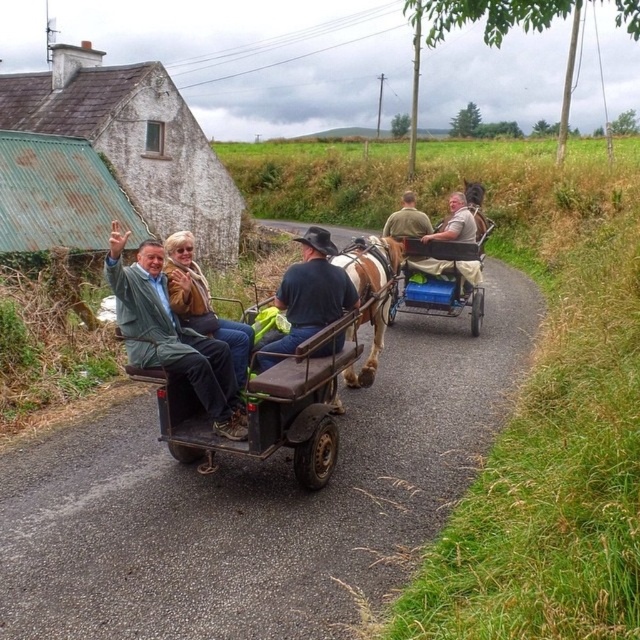
Question: Can you confirm if wooden wagon at center is wider than matte brown jacket at center?

Choices:
 (A) no
 (B) yes

Answer: (B)

Question: Which of the following is the farthest from the observer?

Choices:
 (A) (394, 260)
 (B) (420, 268)
 (C) (268, 424)
 (D) (346, 275)

Answer: (B)

Question: Estimate the real-world distances between objects in this image. Which object is closer to the green fabric jacket at center?

Choices:
 (A) dark blue denim jeans at center
 (B) brown glossy horse at center

Answer: (A)

Question: Which object is the closest to the matte brown jacket at center?

Choices:
 (A) wooden cart at center
 (B) light brown leather jacket at center

Answer: (A)

Question: Does wooden cart at center appear on the right side of matte brown jacket at center?

Choices:
 (A) yes
 (B) no

Answer: (A)

Question: Considering the relative positions of green fabric jacket at center and wooden cart at center in the image provided, where is green fabric jacket at center located with respect to wooden cart at center?

Choices:
 (A) right
 (B) left

Answer: (B)